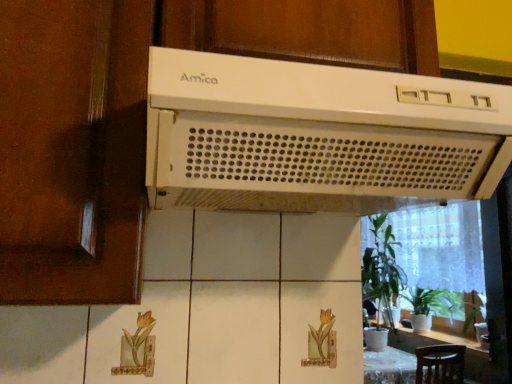
Question: In the image, is matte brown screen door at left positioned in front of or behind green leafy plant at right, acting as the 2th houseplant starting from the right?

Choices:
 (A) front
 (B) behind

Answer: (A)

Question: Is matte brown screen door at left taller or shorter than green leafy plant at right, arranged as the 1th houseplant when viewed from the left?

Choices:
 (A) short
 (B) tall

Answer: (A)

Question: Based on their relative distances, which object is farther from the white plastic amica range hood at upper center?

Choices:
 (A) matte brown screen door at left
 (B) white plastic range hood at upper center
 (C) green leafy plant at right, acting as the 2th houseplant starting from the right
 (D) green glossy houseplant at lower right, positioned as the 2th houseplant in left-to-right order

Answer: (D)

Question: Estimate the real-world distances between objects in this image. Which object is farther from the green glossy houseplant at lower right, positioned as the 2th houseplant in left-to-right order?

Choices:
 (A) matte brown screen door at left
 (B) white plastic range hood at upper center
 (C) white plastic amica range hood at upper center
 (D) green leafy plant at right, acting as the 2th houseplant starting from the right

Answer: (A)